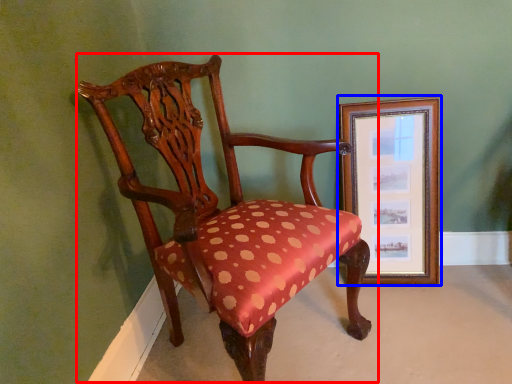
Question: Among these objects, which one is nearest to the camera, chair (highlighted by a red box) or picture frame (highlighted by a blue box)?

Choices:
 (A) chair
 (B) picture frame

Answer: (A)